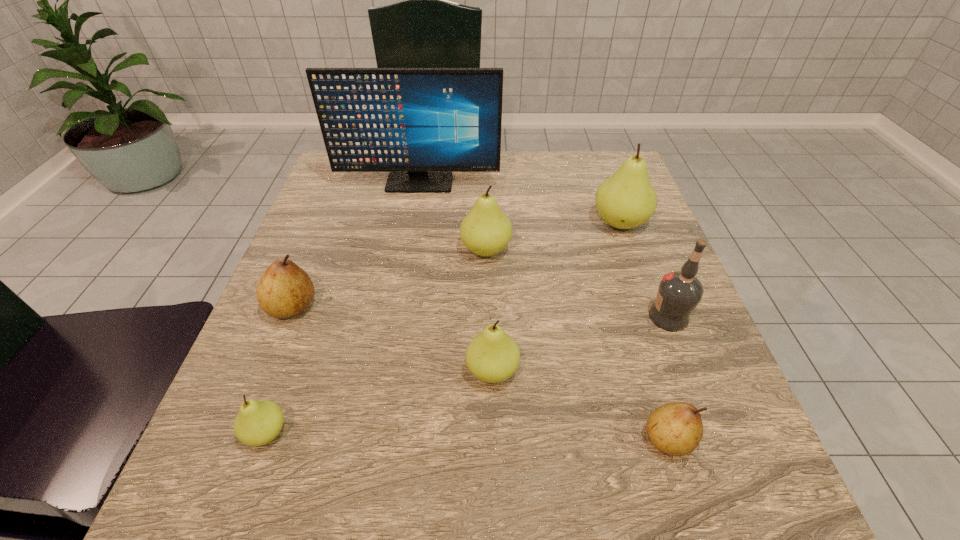
This screenshot has height=540, width=960. I want to click on the second closest green pear to the smallest green pear, so click(x=485, y=231).

In order to click on the third closest green pear relative to the right brown pear in this screenshot , I will do `click(626, 200)`.

This screenshot has width=960, height=540. In order to click on free point that satisfies the following two spatial constraints: 1. on the screen side of the computer monitor; 2. on the right side of the second tallest pear in this screenshot , I will do `click(407, 250)`.

Identify the location of free point that satisfies the following two spatial constraints: 1. on the screen side of the smaller brown pear; 2. on the left side of the tallest object. (374, 439).

Locate an element on the screen. free spot that satisfies the following two spatial constraints: 1. on the screen side of the black computer monitor; 2. on the left side of the nearer brown pear is located at coordinates (374, 439).